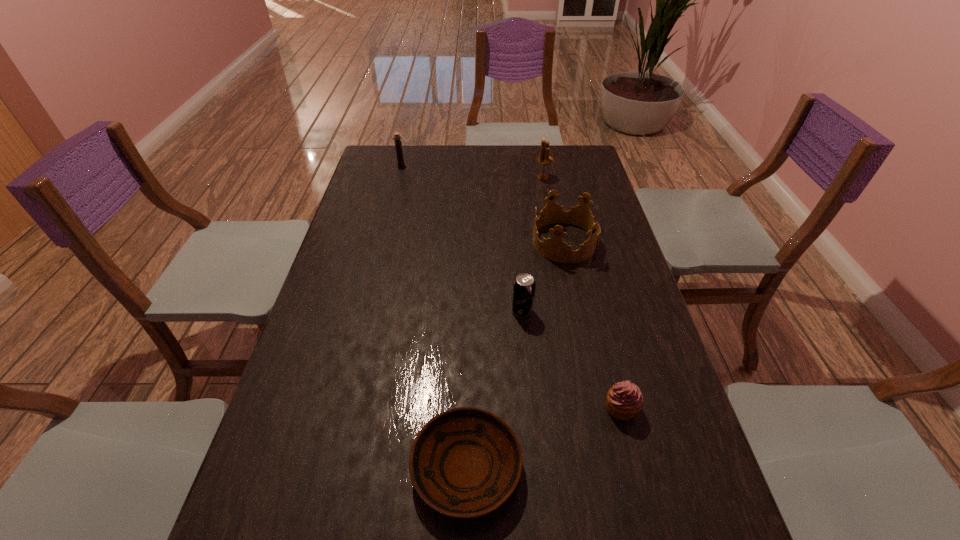
At what (x,y) coordinates should I click in order to perform the action: click on vacant area situated on the back of the fifth nearest object. Please return your answer as a coordinate pair (x, y). Looking at the image, I should click on (539, 153).

The width and height of the screenshot is (960, 540). I want to click on free location located on the right of the shorter candle holder, so click(444, 165).

Identify the location of free space located 0.080m on the front-facing side of the tiara. (507, 242).

Locate an element on the screen. vacant space located 0.070m on the front-facing side of the tiara is located at coordinates (511, 242).

The height and width of the screenshot is (540, 960). I want to click on vacant region located on the front-facing side of the tiara, so pos(482,242).

Identify the location of vacant space located on the right of the third nearest object. (625, 311).

The height and width of the screenshot is (540, 960). I want to click on vacant space positioned 0.170m on the back of the cupcake, so click(x=602, y=335).

I want to click on free location located 0.050m on the left of the plate, so click(x=387, y=468).

Image resolution: width=960 pixels, height=540 pixels. I want to click on object that is at the left edge, so click(x=398, y=144).

You are a GUI agent. You are given a task and a screenshot of the screen. Output one action in this format:
    pyautogui.click(x=<x>, y=<y>)
    Task: Click on the tiara located at the right edge
    This screenshot has height=540, width=960.
    Given the screenshot: What is the action you would take?
    pyautogui.click(x=554, y=248)